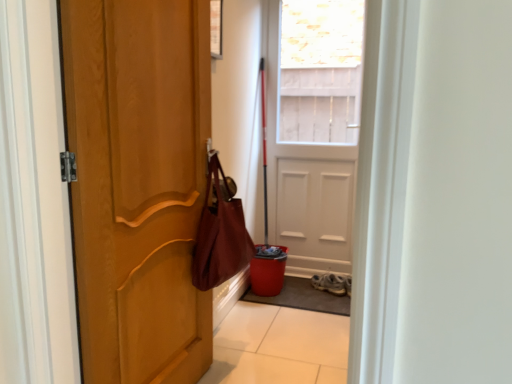
Where is `vacant space in front of white leather sneakers at lower center`? This screenshot has width=512, height=384. vacant space in front of white leather sneakers at lower center is located at coordinates (330, 299).